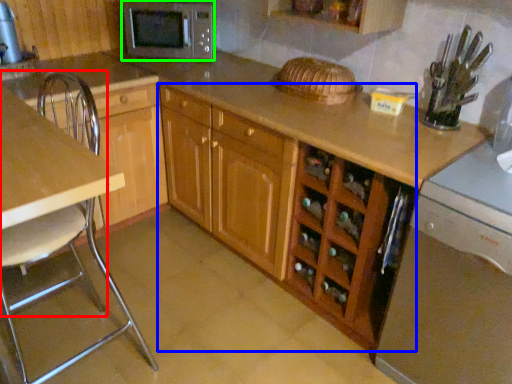
Question: Which object is positioned closest to chair (highlighted by a red box)? Select from cabinetry (highlighted by a blue box) and microwave oven (highlighted by a green box).

Choices:
 (A) cabinetry
 (B) microwave oven

Answer: (B)